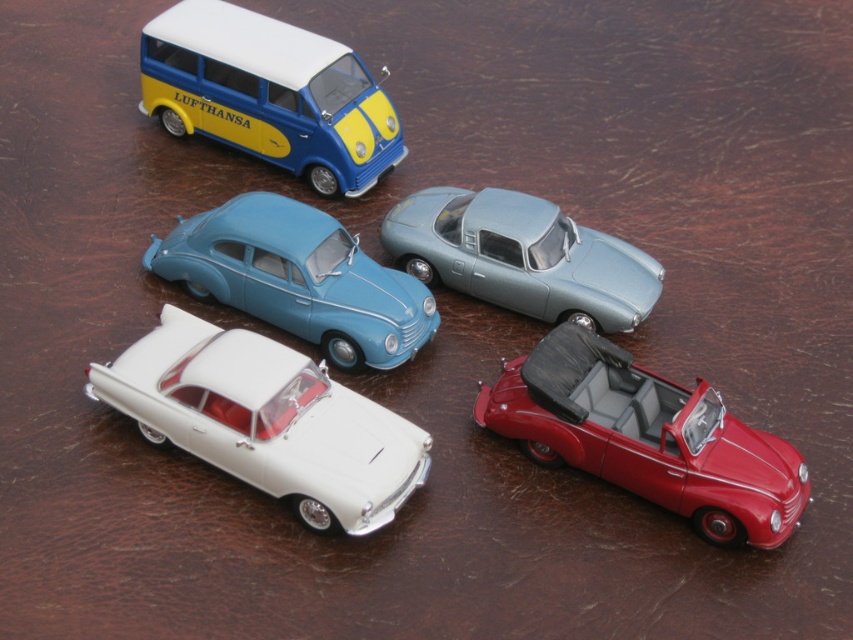
In the scene shown: Is shiny red convertible at bottom right to the right of satin silver car at upper center from the viewer's perspective?

Correct, you'll find shiny red convertible at bottom right to the right of satin silver car at upper center.

Which is in front, point (567, 339) or point (492, 214)?

Point (567, 339)

Between point (560, 461) and point (520, 262), which one is positioned in front?

Point (560, 461)

Find the location of a particular element. shiny red convertible at bottom right is located at coordinates click(x=646, y=436).

Is white glossy sedan at center to the right of shiny red convertible at bottom right from the viewer's perspective?

Incorrect, white glossy sedan at center is not on the right side of shiny red convertible at bottom right.

Is white glossy sedan at center shorter than shiny red convertible at bottom right?

No.

Between point (137, 397) and point (784, 454), which one is positioned in front?

Positioned in front is point (784, 454).

Locate an element on the screen. white glossy sedan at center is located at coordinates (265, 420).

Which of these two, shiny red convertible at bottom right or blue matte van at upper left, stands shorter?

shiny red convertible at bottom right is shorter.

Image resolution: width=853 pixels, height=640 pixels. What do you see at coordinates (646, 436) in the screenshot? I see `shiny red convertible at bottom right` at bounding box center [646, 436].

I want to click on shiny red convertible at bottom right, so click(x=646, y=436).